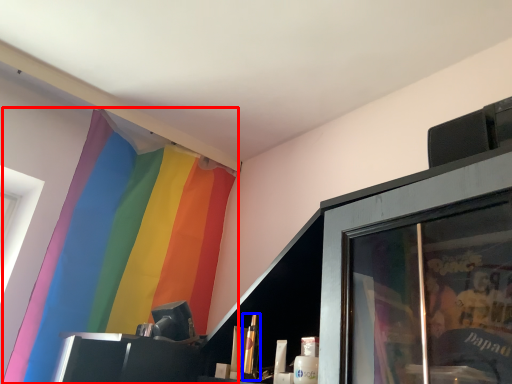
Question: Which object appears farthest to the camera in this image, curtain (highlighted by a red box) or toiletry (highlighted by a blue box)?

Choices:
 (A) curtain
 (B) toiletry

Answer: (A)